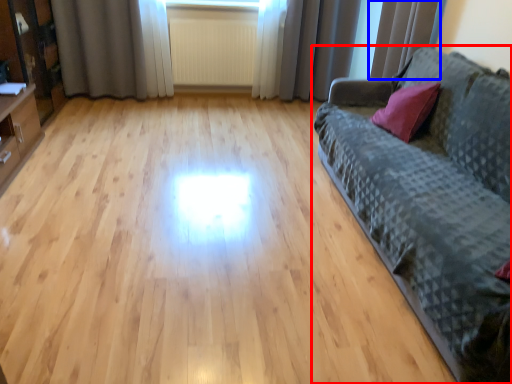
Question: Among these objects, which one is farthest to the camera, studio couch (highlighted by a red box) or curtain (highlighted by a blue box)?

Choices:
 (A) studio couch
 (B) curtain

Answer: (B)